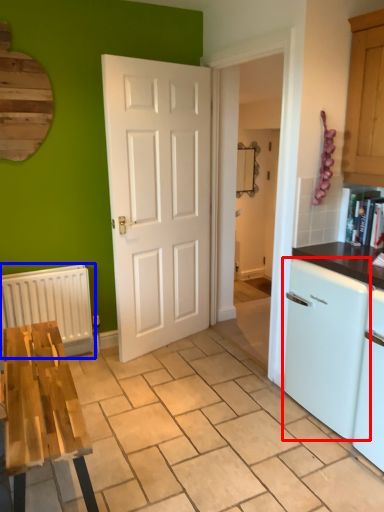
Question: Which of the following is the closest to the observer, dish washer (highlighted by a red box) or radiator (highlighted by a blue box)?

Choices:
 (A) dish washer
 (B) radiator

Answer: (A)